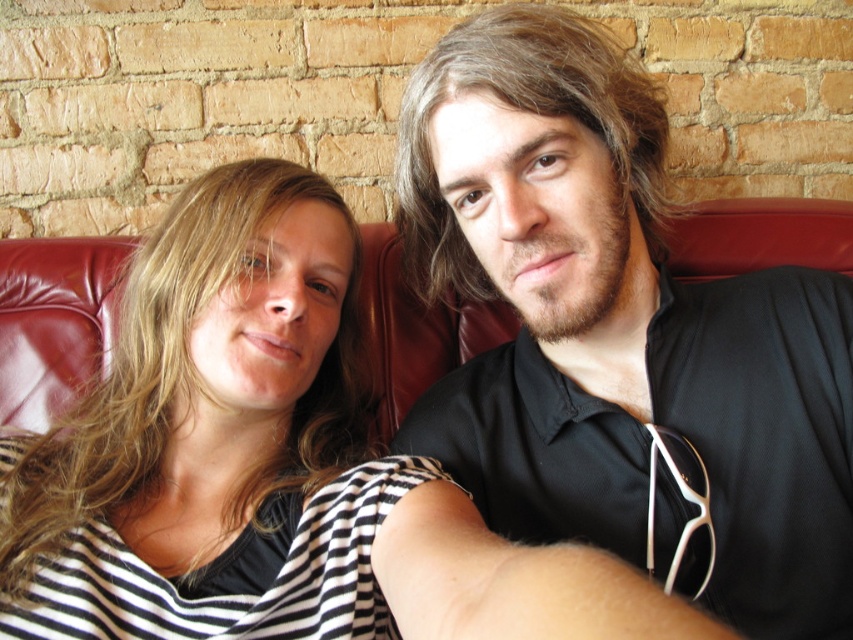
You are a photographer setting up for a portrait shoot. You notice two items in the scene that might interfere with the background. The black matte shirt at center and the striped fabric at center. Which item is closer to the camera, potentially causing a distraction in the background?

The striped fabric at center is behind the black matte shirt at center, so the black matte shirt at center is closer to the camera and would be the item causing a distraction in the background.

Consider the image. You are a photographer trying to capture a closeup of the black matte shirt at center and the striped fabric at center. Which one is located to the left of the other?

The black matte shirt at center is positioned on the right side of striped fabric at center, so the striped fabric at center is to the left of the black matte shirt at center.

You are standing in front of the red leather couch where two people are sitting. You want to place a small plant between the two points marked as point (808, 317) and point (376, 602). Which point should the plant be closer to so it appears closer to you?

The plant should be placed closer to point (376, 602) because point (808, 317) is further away from you, while point (376, 602) is closer. This way, the plant will appear nearer to your viewpoint.